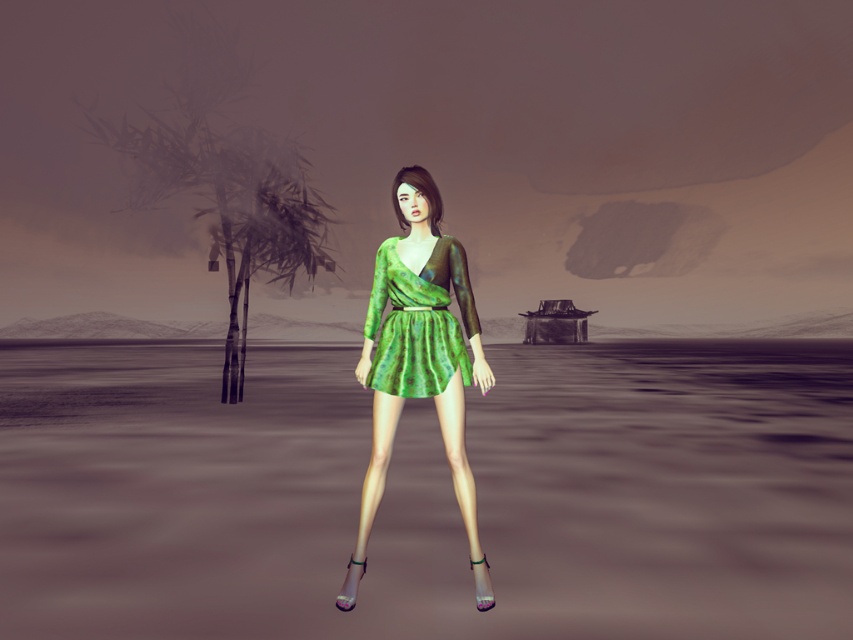
You are an observer in the scene and want to know the position of the green shiny dress at center relative to the green textured dress at center. Which one is on the left side?

The green shiny dress at center is to the left of the green textured dress at center.

You are a photographer trying to capture the figure in the surreal scene. The camera you are using has a fixed focus point at coordinates 0.772, 0.502. Will the green glossy water at center be in focus when you take the photo?

The green glossy water at center is positioned exactly at the coordinates (427,493), so it will be in focus since the camera focuses at that point.

You are an observer standing at the edge of the green glossy water at center and looking towards the green textured dress at center. Which object is closer to you?

The green glossy water at center is closer to you because it is positioned under the green textured dress at center, meaning the dress is above the water.